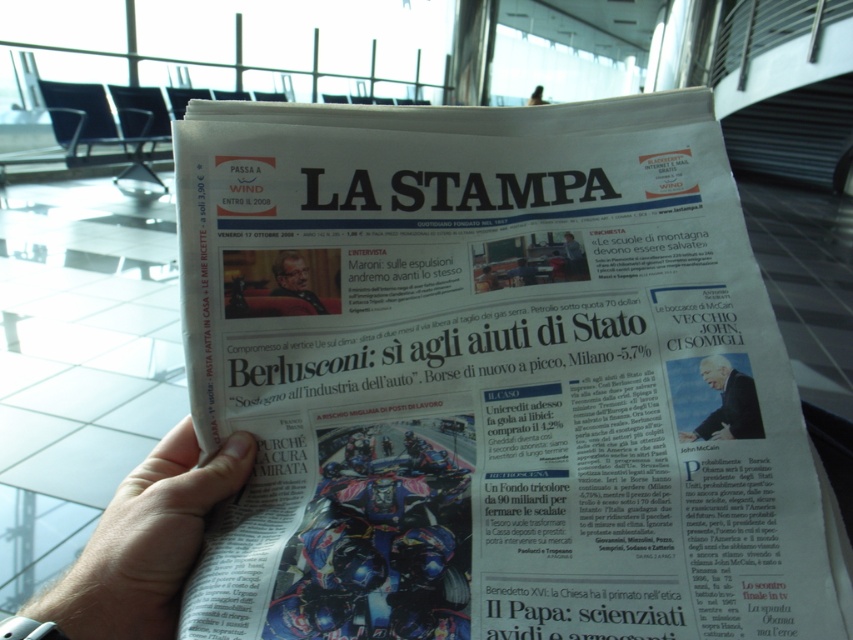
Does dark suit jacket at upper right have a lesser height compared to smooth skin portrait at center?

No.

Is dark suit jacket at upper right wider than smooth skin portrait at center?

Correct, the width of dark suit jacket at upper right exceeds that of smooth skin portrait at center.

Does point (756, 416) come in front of point (274, 260)?

Yes, point (756, 416) is in front of point (274, 260).

At what (x,y) coordinates should I click in order to perform the action: click on dark suit jacket at upper right. Please return your answer as a coordinate pair (x, y). The width and height of the screenshot is (853, 640). Looking at the image, I should click on (727, 403).

Which is more to the left, skinny white hand at lower left or smooth skin portrait at center?

skinny white hand at lower left

Can you confirm if skinny white hand at lower left is positioned below smooth skin portrait at center?

Yes.

Measure the distance between skinny white hand at lower left and camera.

They are 12.89 inches apart.

This screenshot has width=853, height=640. I want to click on skinny white hand at lower left, so click(x=144, y=541).

Is white glossy newspaper at center shorter than skinny white hand at lower left?

Incorrect, white glossy newspaper at center's height does not fall short of skinny white hand at lower left's.

The height and width of the screenshot is (640, 853). Describe the element at coordinates (489, 378) in the screenshot. I see `white glossy newspaper at center` at that location.

Identify the location of white glossy newspaper at center. Image resolution: width=853 pixels, height=640 pixels. (489, 378).